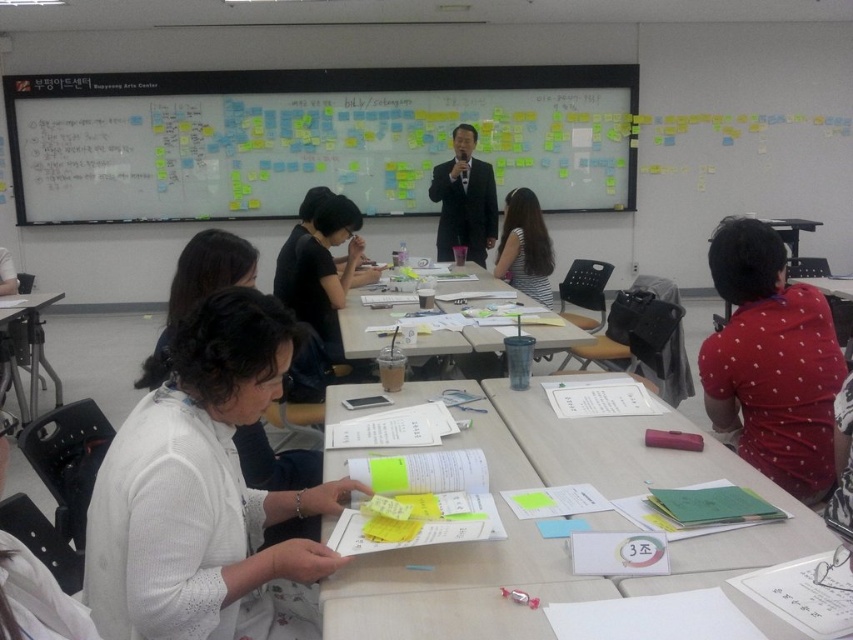
You are a photographer in the classroom and want to capture both the black matte shirt at center and the satin black suit at center in a single photo. Since the camera has a fixed focus, you need to ensure both subjects are within the same focal plane. Given their heights, which subject should you adjust the camera height to focus on to include both?

The black matte shirt at center is not as tall as the satin black suit at center, so you should adjust the camera height to focus on the satin black suit at center to ensure both are within the same focal plane.

You are a photographer standing at the back of the classroom. You need to take a photo of both the black matte shirt at center and the satin black suit at center. Based on their positions, which one is closer to the camera?

The black matte shirt at center is located below the satin black suit at center, so the satin black suit at center is closer to the camera.

Consider the image. You are a student who needs to retrieve your pink phone from the table. The white paper at center and black matte shirt at center are in your way. Which object should you move first to reach your phone?

The white paper at center is positioned on the right side of black matte shirt at center. To reach your pink phone, you should move the black matte shirt at center first since it is closer to you and blocking the path to the white paper at center.